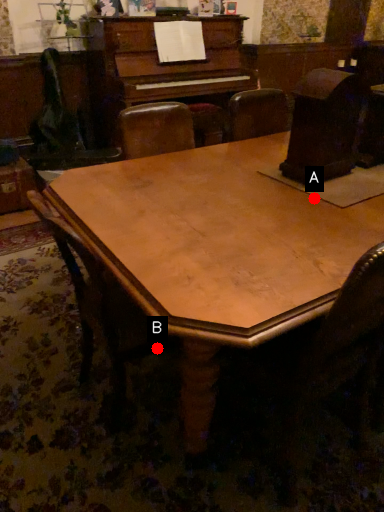
Question: Two points are circled on the image, labeled by A and B beside each circle. Which point is closer to the camera?

Choices:
 (A) A is closer
 (B) B is closer

Answer: (A)